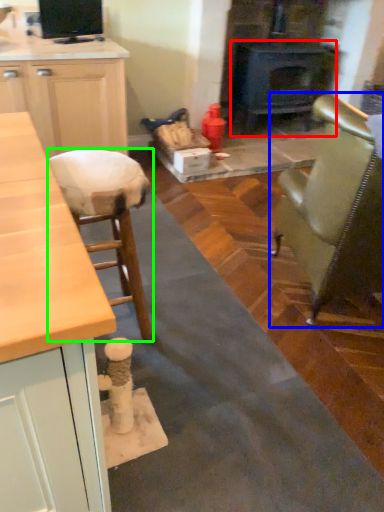
Question: Which object is the closest to the wood burning stove (highlighted by a red box)? Choose among these: chair (highlighted by a blue box) or stool (highlighted by a green box).

Choices:
 (A) chair
 (B) stool

Answer: (A)